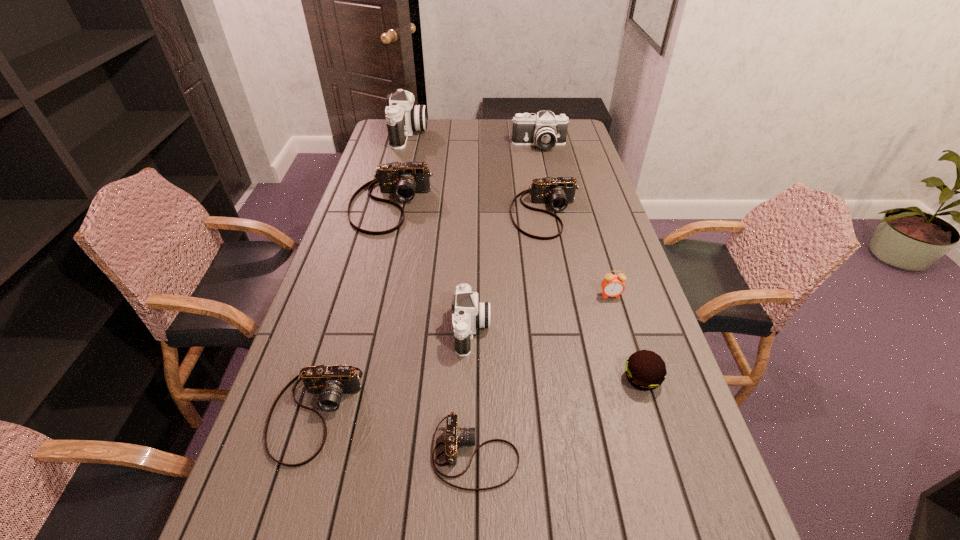
This screenshot has width=960, height=540. In order to click on the leftmost black camera in this screenshot , I will do `click(402, 117)`.

Find the location of a particular element. This screenshot has height=540, width=960. the tallest object is located at coordinates [402, 117].

Find the location of a particular element. Image resolution: width=960 pixels, height=540 pixels. the second biggest black camera is located at coordinates (545, 130).

Where is `the rightmost black camera`? the rightmost black camera is located at coordinates (545, 130).

Find the location of a particular element. This screenshot has height=540, width=960. the third nearest camera is located at coordinates (470, 314).

Locate an element on the screen. This screenshot has height=540, width=960. the nearest black camera is located at coordinates click(x=470, y=314).

The width and height of the screenshot is (960, 540). Find the location of `the biggest brown camera`. the biggest brown camera is located at coordinates (404, 180).

This screenshot has height=540, width=960. Find the location of `the fifth farthest object`. the fifth farthest object is located at coordinates (612, 285).

You are a GUI agent. You are given a task and a screenshot of the screen. Output one action in this format:
    pyautogui.click(x=<x>, y=<y>)
    Task: Click on the alarm clock
    This screenshot has height=540, width=960.
    Given the screenshot: What is the action you would take?
    pyautogui.click(x=612, y=285)

I want to click on the rightmost brown camera, so click(558, 192).